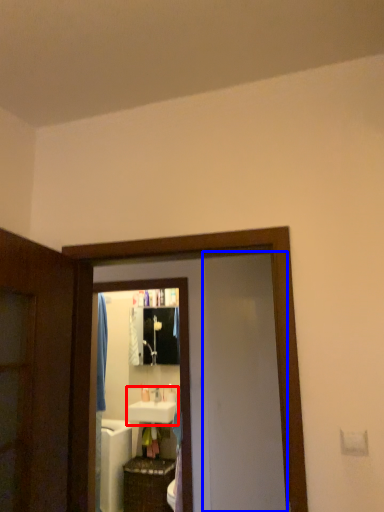
Question: Which object is further to the camera taking this photo, sink (highlighted by a red box) or screen door (highlighted by a blue box)?

Choices:
 (A) sink
 (B) screen door

Answer: (A)